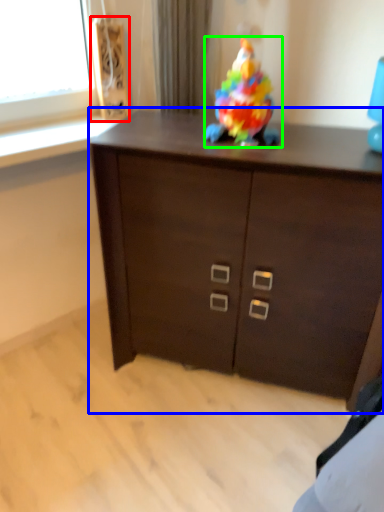
Question: Which is farther away from speaker (highlighted by a red box)? chest of drawers (highlighted by a blue box) or toy (highlighted by a green box)?

Choices:
 (A) chest of drawers
 (B) toy

Answer: (A)